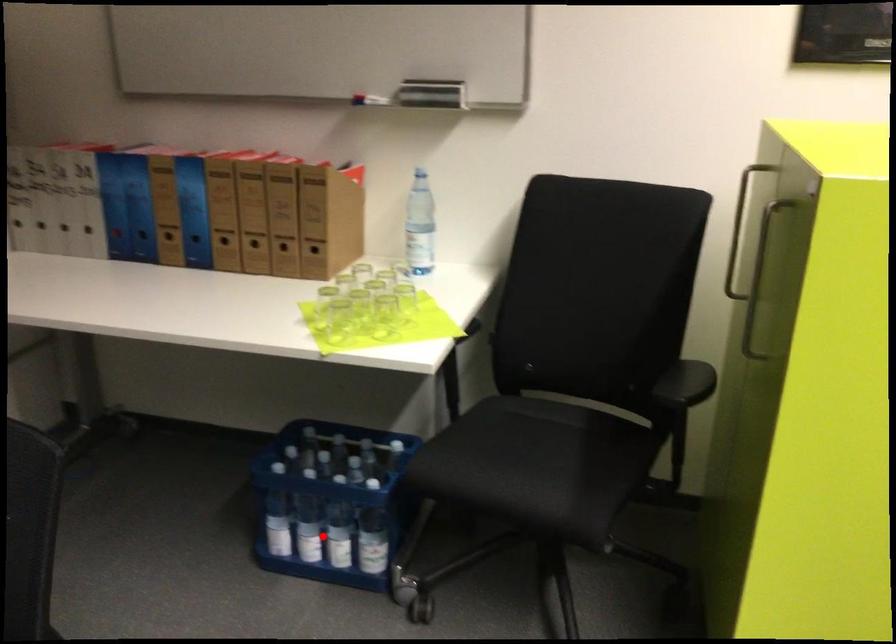
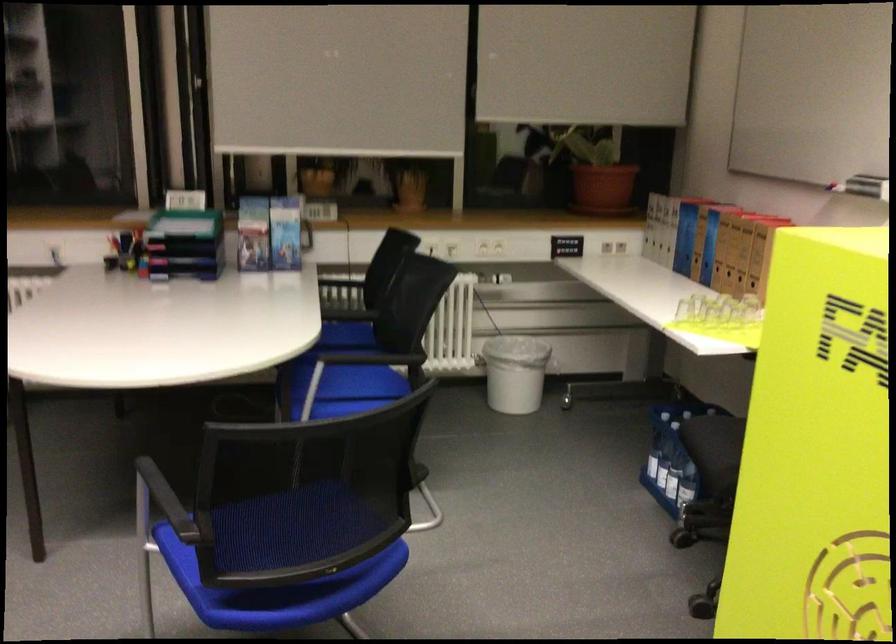
Where in the second image is the point corresponding to the highlighted location from the first image?

(667, 471)